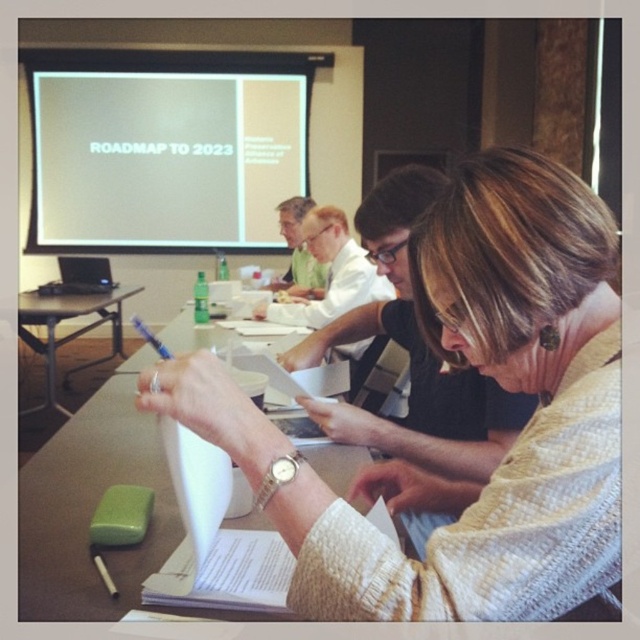
This screenshot has width=640, height=640. I want to click on white matte projector screen at upper left, so click(164, 157).

Who is more distant from viewer, (141, 147) or (280, 225)?

Point (141, 147)

Identify the location of white matte projector screen at upper left. Image resolution: width=640 pixels, height=640 pixels. (164, 157).

Where is `white matte projector screen at upper left`? white matte projector screen at upper left is located at coordinates pos(164,157).

Is white paper at center to the left of blue plastic pen at center from the viewer's perspective?

Incorrect, white paper at center is not on the left side of blue plastic pen at center.

Is the position of white paper at center less distant than that of blue plastic pen at center?

No, it is behind blue plastic pen at center.

This screenshot has height=640, width=640. Identify the location of white paper at center. (330, 273).

Who is positioned more to the right, white knitted sweater at center or white matte projector screen at upper left?

From the viewer's perspective, white knitted sweater at center appears more on the right side.

Describe the element at coordinates (481, 372) in the screenshot. This screenshot has height=640, width=640. I see `white knitted sweater at center` at that location.

Is point (513, 472) positioned in front of point (176, 148)?

That is True.

You are a GUI agent. You are given a task and a screenshot of the screen. Output one action in this format:
    pyautogui.click(x=<x>, y=<y>)
    Task: Click on the white knitted sweater at center
    This screenshot has height=640, width=640.
    Given the screenshot: What is the action you would take?
    pyautogui.click(x=481, y=372)